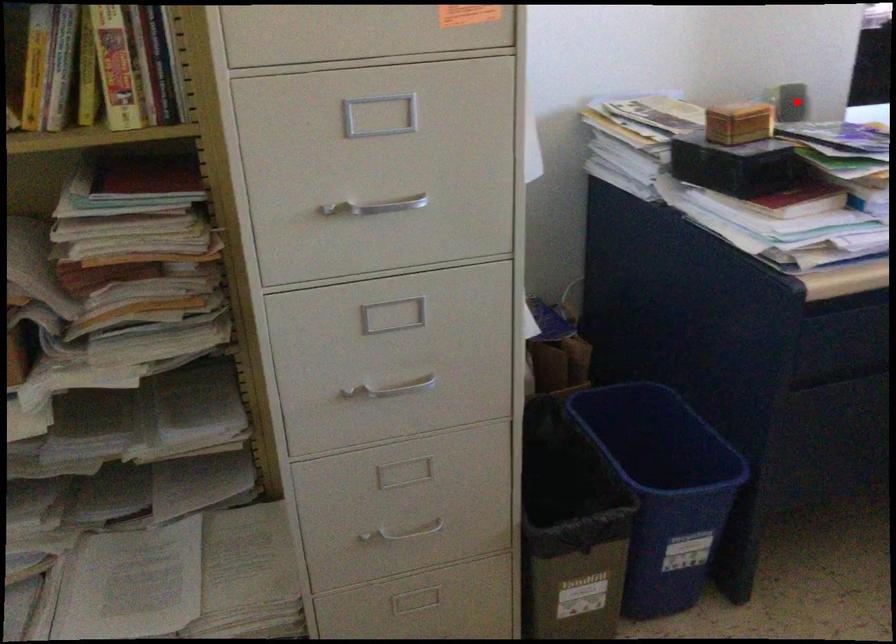
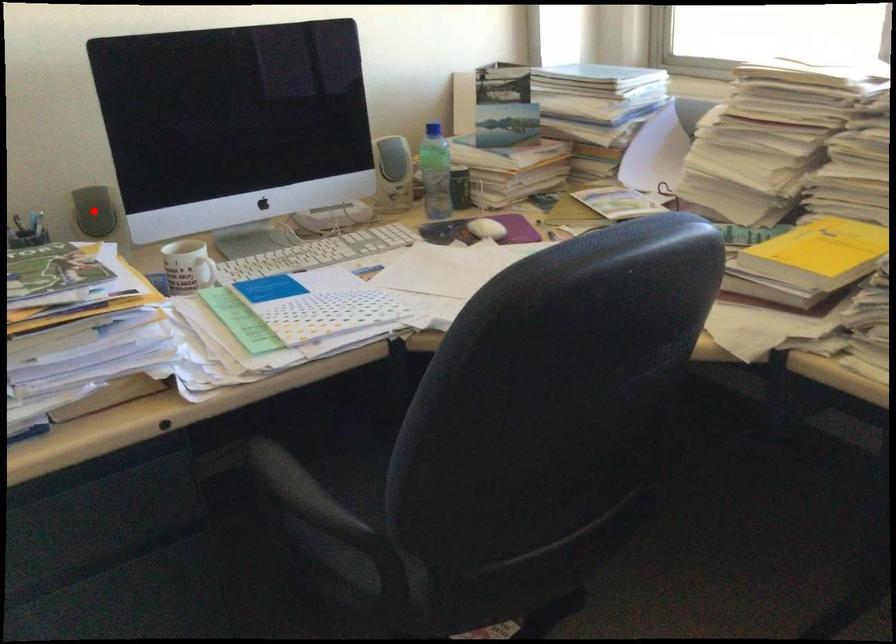
I am providing you with two images of the same scene from different viewpoints. A red point is marked on the first image and another point is marked on the second image. Do the highlighted points in image1 and image2 indicate the same real-world spot?

Yes